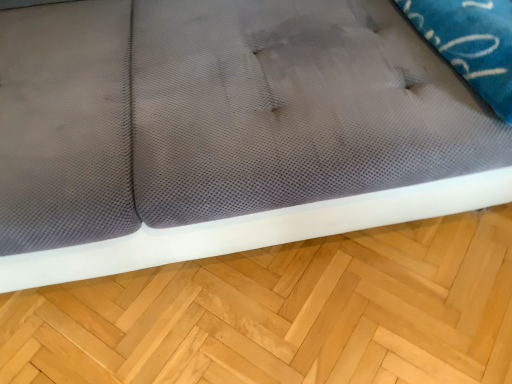
In order to face light brown wood at lower center, should I rotate leftwards or rightwards?

Rotate your view right by about 3.494°.

The image size is (512, 384). In order to click on light brown wood at lower center in this screenshot , I will do `click(285, 313)`.

The height and width of the screenshot is (384, 512). What do you see at coordinates (285, 313) in the screenshot?
I see `light brown wood at lower center` at bounding box center [285, 313].

You are a GUI agent. You are given a task and a screenshot of the screen. Output one action in this format:
    pyautogui.click(x=<x>, y=<y>)
    Task: Click on the white mesh pillow at upper right
    
    Given the screenshot: What is the action you would take?
    pyautogui.click(x=471, y=43)

This screenshot has width=512, height=384. What do you see at coordinates (471, 43) in the screenshot?
I see `white mesh pillow at upper right` at bounding box center [471, 43].

The height and width of the screenshot is (384, 512). What are the coordinates of `light brown wood at lower center` in the screenshot? It's located at [x=285, y=313].

Between light brown wood at lower center and white mesh pillow at upper right, which one appears on the left side from the viewer's perspective?

Positioned to the left is light brown wood at lower center.

Is the depth of light brown wood at lower center greater than that of white mesh pillow at upper right?

That is True.

Between point (463, 227) and point (455, 13), which one is positioned in front?

The point (455, 13) is closer to the camera.

From the image's perspective, which is below, light brown wood at lower center or white mesh pillow at upper right?

light brown wood at lower center is shown below in the image.

From a real-world perspective, which is physically above, light brown wood at lower center or white mesh pillow at upper right?

In real-world perspective, white mesh pillow at upper right is above.

Can you confirm if light brown wood at lower center is thinner than white mesh pillow at upper right?

Indeed, light brown wood at lower center has a lesser width compared to white mesh pillow at upper right.

Is light brown wood at lower center taller or shorter than white mesh pillow at upper right?

Clearly, light brown wood at lower center is shorter compared to white mesh pillow at upper right.

Can you confirm if light brown wood at lower center is smaller than white mesh pillow at upper right?

Actually, light brown wood at lower center might be larger than white mesh pillow at upper right.

Looking at this image, choose the correct answer: Is light brown wood at lower center inside white mesh pillow at upper right or outside it?

light brown wood at lower center exists outside the volume of white mesh pillow at upper right.

Is light brown wood at lower center directly adjacent to white mesh pillow at upper right?

No, light brown wood at lower center is not touching white mesh pillow at upper right.

Could you tell me if light brown wood at lower center is facing white mesh pillow at upper right?

No, light brown wood at lower center does not turn towards white mesh pillow at upper right.

How many degrees apart are the facing directions of light brown wood at lower center and white mesh pillow at upper right?

The angular difference between light brown wood at lower center and white mesh pillow at upper right is 180 degrees.

The height and width of the screenshot is (384, 512). Identify the location of pillow in front of the light brown wood at lower center. (471, 43).

Can you confirm if white mesh pillow at upper right is positioned to the right of light brown wood at lower center?

Yes, white mesh pillow at upper right is to the right of light brown wood at lower center.

Between white mesh pillow at upper right and light brown wood at lower center, which one is positioned in front?

white mesh pillow at upper right is in front.

Between point (465, 68) and point (111, 287), which one is positioned behind?

The point (111, 287) is farther from the camera.

From the image's perspective, is white mesh pillow at upper right above or below light brown wood at lower center?

white mesh pillow at upper right is above light brown wood at lower center.

From a real-world perspective, is white mesh pillow at upper right above or below light brown wood at lower center?

white mesh pillow at upper right is situated higher than light brown wood at lower center in the real world.

Which of these two, white mesh pillow at upper right or light brown wood at lower center, is wider?

white mesh pillow at upper right is wider.

Who is shorter, white mesh pillow at upper right or light brown wood at lower center?

light brown wood at lower center is shorter.

Which of these two, white mesh pillow at upper right or light brown wood at lower center, is bigger?

light brown wood at lower center.

Is light brown wood at lower center located within white mesh pillow at upper right?

No, light brown wood at lower center is located outside of white mesh pillow at upper right.

Is white mesh pillow at upper right not near light brown wood at lower center?

white mesh pillow at upper right is actually quite close to light brown wood at lower center.

Could you tell me if white mesh pillow at upper right is facing light brown wood at lower center?

No, white mesh pillow at upper right is not facing towards light brown wood at lower center.

Can you tell me how much white mesh pillow at upper right and light brown wood at lower center differ in facing direction?

180 degrees separate the facing orientations of white mesh pillow at upper right and light brown wood at lower center.

How far apart are white mesh pillow at upper right and light brown wood at lower center?

white mesh pillow at upper right and light brown wood at lower center are 25.68 inches apart from each other.

Locate an element on the screen. The height and width of the screenshot is (384, 512). pillow above the light brown wood at lower center (from a real-world perspective) is located at coordinates (471, 43).

The width and height of the screenshot is (512, 384). I want to click on hardwood below the white mesh pillow at upper right (from the image's perspective), so click(285, 313).

Where is `pillow on the right of the light brown wood at lower center`? This screenshot has height=384, width=512. pillow on the right of the light brown wood at lower center is located at coordinates (471, 43).